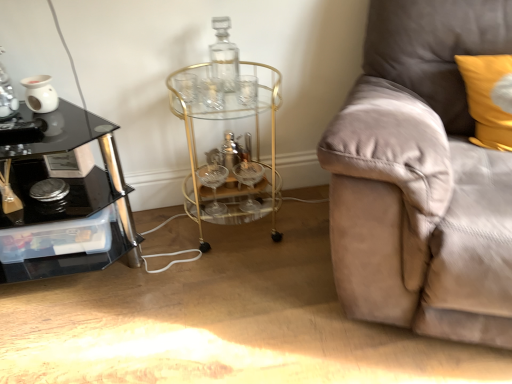
What is the approximate height of suede couch at right?

It is 35.64 inches.

This screenshot has width=512, height=384. In order to click on black glass table at left in this screenshot , I will do `click(66, 203)`.

Considering the sizes of objects transparent glass bottle at center and gold metallic bar cart at center in the image provided, who is wider, transparent glass bottle at center or gold metallic bar cart at center?

gold metallic bar cart at center is wider.

Is transparent glass bottle at center facing away from gold metallic bar cart at center?

transparent glass bottle at center does not have its back to gold metallic bar cart at center.

From the image's perspective, which one is positioned lower, transparent glass bottle at center or gold metallic bar cart at center?

gold metallic bar cart at center is shown below in the image.

Which object is positioned more to the right, black glass table at left or transparent glass bottle at center?

transparent glass bottle at center is more to the right.

Is black glass table at left far away from transparent glass bottle at center?

black glass table at left is actually quite close to transparent glass bottle at center.

From a real-world perspective, is black glass table at left positioned over transparent glass bottle at center based on gravity?

Actually, black glass table at left is physically below transparent glass bottle at center in the real world.

In the scene shown: Can you tell me how much gold metallic bar cart at center and yellow fabric pillow at upper right differ in facing direction?

There is a 25.6-degree angle between the facing directions of gold metallic bar cart at center and yellow fabric pillow at upper right.

From the picture: Which of these two, gold metallic bar cart at center or yellow fabric pillow at upper right, stands shorter?

yellow fabric pillow at upper right is shorter.

From the image's perspective, is gold metallic bar cart at center positioned above or below yellow fabric pillow at upper right?

Based on their image positions, gold metallic bar cart at center is located beneath yellow fabric pillow at upper right.

In terms of width, does gold metallic bar cart at center look wider or thinner when compared to yellow fabric pillow at upper right?

Considering their sizes, gold metallic bar cart at center looks broader than yellow fabric pillow at upper right.

Considering the sizes of suede couch at right and gold metallic bar cart at center in the image, is suede couch at right wider or thinner than gold metallic bar cart at center?

suede couch at right is wider than gold metallic bar cart at center.

From the image's perspective, who appears lower, suede couch at right or gold metallic bar cart at center?

gold metallic bar cart at center.

Considering the relative sizes of suede couch at right and gold metallic bar cart at center in the image provided, is suede couch at right smaller than gold metallic bar cart at center?

No, suede couch at right is not smaller than gold metallic bar cart at center.

Between transparent glass bottle at center and yellow fabric pillow at upper right, which one has larger width?

Wider between the two is yellow fabric pillow at upper right.

Could you tell me if transparent glass bottle at center is facing yellow fabric pillow at upper right?

No, transparent glass bottle at center is not aimed at yellow fabric pillow at upper right.

Is point (226, 89) closer or farther from the camera than point (487, 133)?

Clearly, point (226, 89) is more distant from the camera than point (487, 133).

Looking at the image, does transparent glass bottle at center seem bigger or smaller compared to yellow fabric pillow at upper right?

Considering their sizes, transparent glass bottle at center takes up less space than yellow fabric pillow at upper right.

Who is more distant, transparent glass bottle at center or black glass table at left?

Positioned behind is transparent glass bottle at center.

Would you say transparent glass bottle at center is to the left or to the right of black glass table at left in the picture?

transparent glass bottle at center is to the right of black glass table at left.

Is transparent glass bottle at center spatially inside black glass table at left, or outside of it?

transparent glass bottle at center lies outside black glass table at left.

Which is further, [223,76] or [108,140]?

The point [223,76] is more distant.

Considering the sizes of suede couch at right and yellow fabric pillow at upper right in the image, is suede couch at right taller or shorter than yellow fabric pillow at upper right?

In the image, suede couch at right appears to be taller than yellow fabric pillow at upper right.

Is yellow fabric pillow at upper right at the back of suede couch at right?

Yes, suede couch at right's orientation is away from yellow fabric pillow at upper right.

Considering the points (435, 298) and (493, 58), which point is behind, point (435, 298) or point (493, 58)?

Positioned behind is point (493, 58).

Where is `bottle that appears on the left of gold metallic bar cart at center`? bottle that appears on the left of gold metallic bar cart at center is located at coordinates tap(224, 56).

At what (x,y) coordinates should I click in order to perform the action: click on bottle to the right of black glass table at left. Please return your answer as a coordinate pair (x, y). Image resolution: width=512 pixels, height=384 pixels. Looking at the image, I should click on (224, 56).

Looking at this image, based on their spatial positions, is black glass table at left or suede couch at right closer to gold metallic bar cart at center?

The object closer to gold metallic bar cart at center is black glass table at left.

From the image, which object appears to be farther from gold metallic bar cart at center, yellow fabric pillow at upper right or transparent glass bottle at center?

Among the two, yellow fabric pillow at upper right is located further to gold metallic bar cart at center.

Which object lies further to the anchor point black glass table at left, suede couch at right or transparent glass bottle at center?

suede couch at right lies further to black glass table at left than the other object.

Based on their spatial positions, is gold metallic bar cart at center or yellow fabric pillow at upper right further from suede couch at right?

The object further to suede couch at right is gold metallic bar cart at center.

Based on their spatial positions, is black glass table at left or transparent glass bottle at center further from yellow fabric pillow at upper right?

The object further to yellow fabric pillow at upper right is black glass table at left.

When comparing their distances from yellow fabric pillow at upper right, does gold metallic bar cart at center or transparent glass bottle at center seem closer?

gold metallic bar cart at center is closer to yellow fabric pillow at upper right.

Based on their spatial positions, is gold metallic bar cart at center or yellow fabric pillow at upper right further from transparent glass bottle at center?

yellow fabric pillow at upper right.

Looking at the image, which one is located further to suede couch at right, yellow fabric pillow at upper right or gold metallic bar cart at center?

The object further to suede couch at right is gold metallic bar cart at center.

Where is `round table located between black glass table at left and suede couch at right in the left-right direction`? The image size is (512, 384). round table located between black glass table at left and suede couch at right in the left-right direction is located at coordinates (241, 153).

Where is `bottle located between black glass table at left and suede couch at right in the left-right direction`? bottle located between black glass table at left and suede couch at right in the left-right direction is located at coordinates (224, 56).

Where is `studio couch between transparent glass bottle at center and yellow fabric pillow at upper right in the horizontal direction`? studio couch between transparent glass bottle at center and yellow fabric pillow at upper right in the horizontal direction is located at coordinates (422, 178).

This screenshot has height=384, width=512. I want to click on bottle situated between black glass table at left and yellow fabric pillow at upper right from left to right, so click(x=224, y=56).